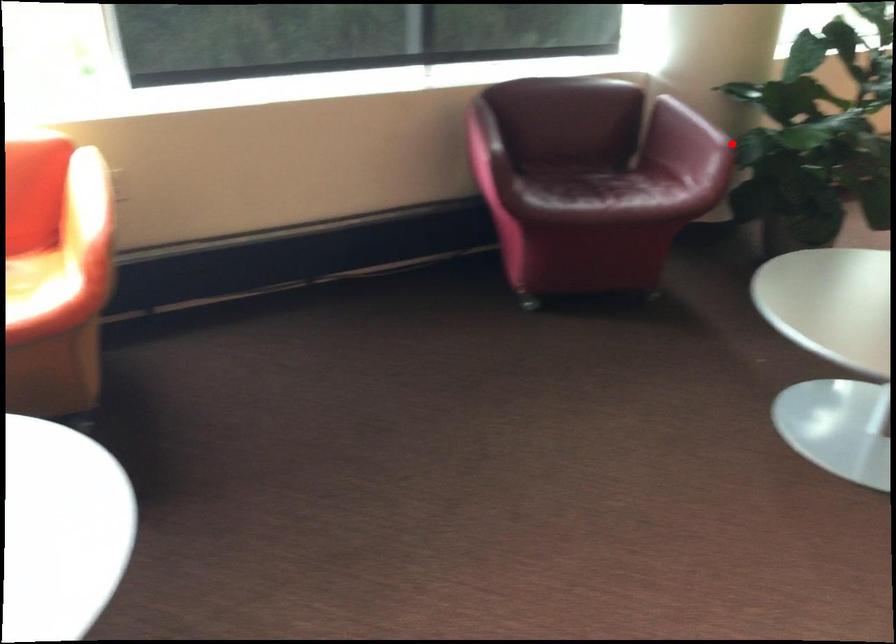
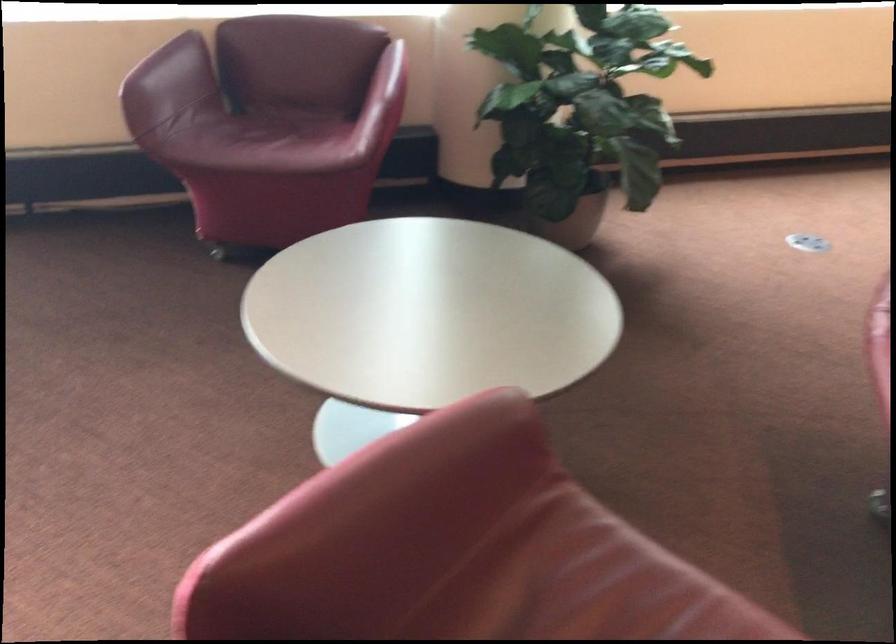
The point at the highlighted location is marked in the first image. Where is the corresponding point in the second image?

(385, 100)